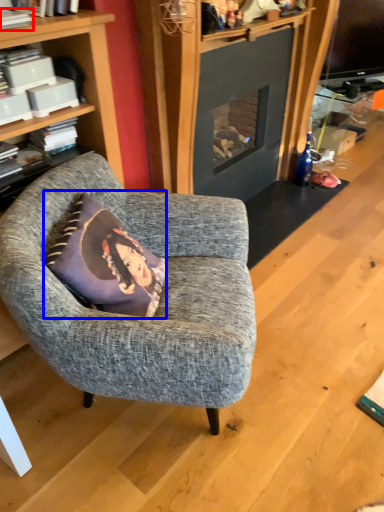
Question: Which object is closer to the camera taking this photo, book (highlighted by a red box) or pillow (highlighted by a blue box)?

Choices:
 (A) book
 (B) pillow

Answer: (B)